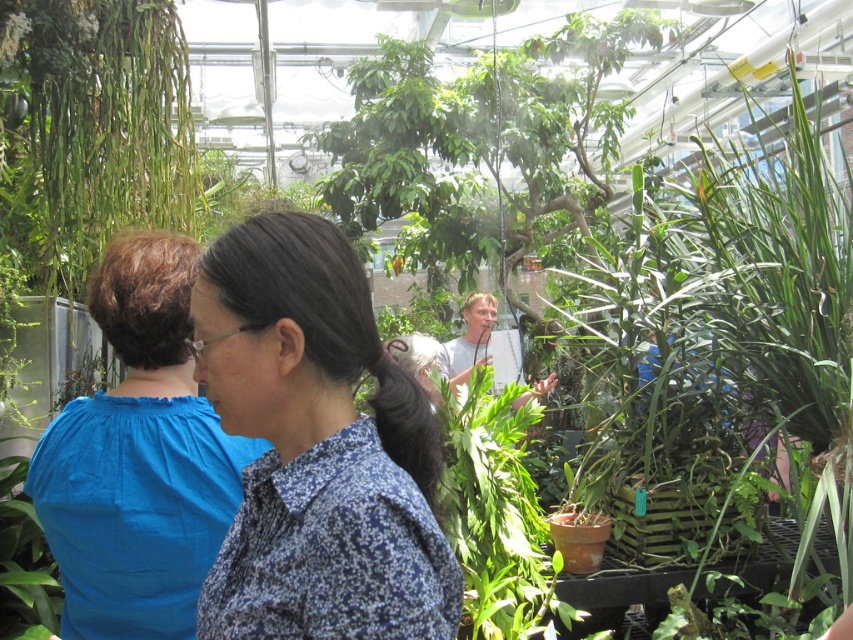
Is blue cotton blouse at left below green matte leaf at center?

No, blue cotton blouse at left is not below green matte leaf at center.

Who is more forward, (169, 288) or (16, 614)?

Positioned in front is point (169, 288).

Who is more distant from viewer, (80, 509) or (45, 624)?

Point (45, 624)

I want to click on blue cotton blouse at left, so click(x=138, y=458).

Can you confirm if blue printed shirt at center is bigger than blue cotton blouse at left?

Actually, blue printed shirt at center might be smaller than blue cotton blouse at left.

Is point (399, 506) positioned before point (172, 528)?

Yes, point (399, 506) is closer to viewer.

Where is `blue printed shirt at center`? blue printed shirt at center is located at coordinates (316, 449).

Who is positioned more to the right, blue printed shirt at center or green matte leaf at center?

Positioned to the right is blue printed shirt at center.

In the scene shown: Between blue printed shirt at center and green matte leaf at center, which one appears on the left side from the viewer's perspective?

green matte leaf at center

Where is `blue printed shirt at center`? blue printed shirt at center is located at coordinates (316, 449).